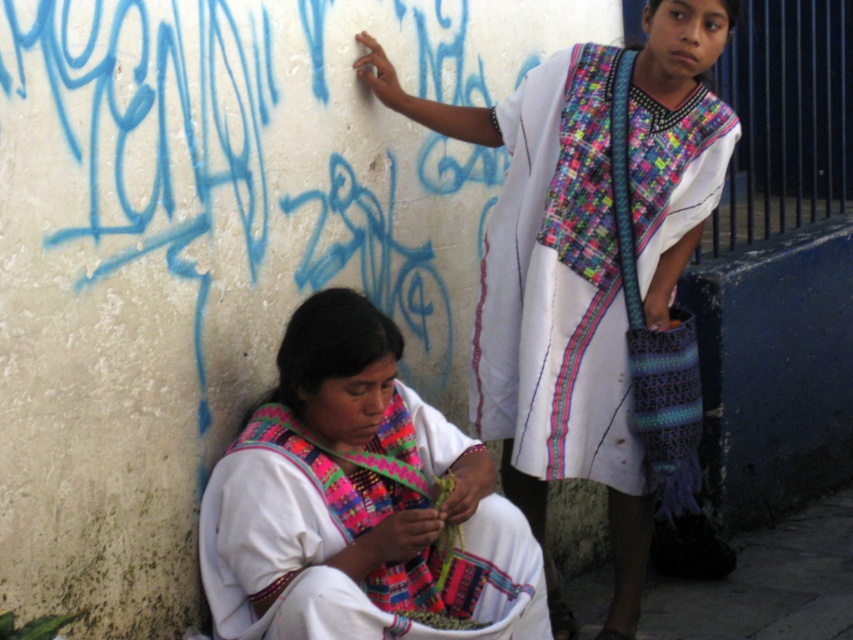
Is white woven fabric dress at upper center further to the viewer compared to matte white shawl at lower left?

Yes, it is.

You are a GUI agent. You are given a task and a screenshot of the screen. Output one action in this format:
    pyautogui.click(x=<x>, y=<y>)
    Task: Click on the white woven fabric dress at upper center
    
    Given the screenshot: What is the action you would take?
    pyautogui.click(x=550, y=300)